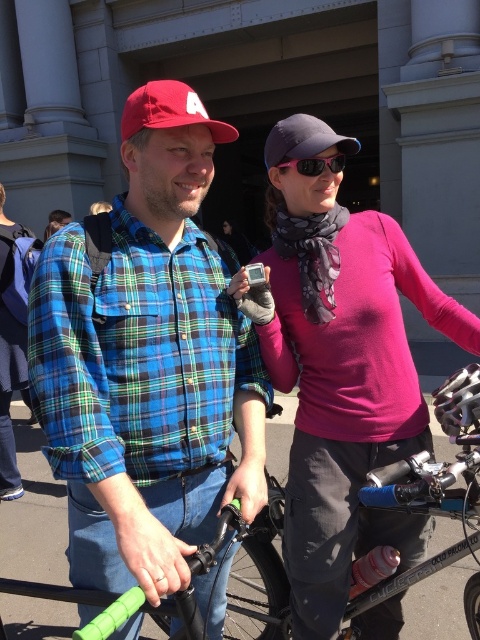
Question: Among these objects, which one is nearest to the camera?

Choices:
 (A) pink matte sweater at center
 (B) blue plaid shirt at center
 (C) dark gray fabric baseball cap at upper center

Answer: (B)

Question: Can you confirm if pink matte sweater at center is wider than dark gray fabric baseball cap at upper center?

Choices:
 (A) yes
 (B) no

Answer: (A)

Question: Is dark gray fabric baseball cap at upper center further to the viewer compared to pink matte sunglasses at upper center?

Choices:
 (A) no
 (B) yes

Answer: (B)

Question: Which point is farther to the camera?

Choices:
 (A) pink matte sunglasses at upper center
 (B) dark gray fabric baseball cap at upper center
 (C) blue plaid shirt at center
 (D) matte red baseball cap at upper left

Answer: (B)

Question: Among these objects, which one is nearest to the camera?

Choices:
 (A) pink matte sweater at center
 (B) matte red baseball cap at upper left
 (C) blue plaid shirt at center
 (D) pink matte sunglasses at upper center

Answer: (C)

Question: Can you confirm if dark gray fabric baseball cap at upper center is wider than pink matte sunglasses at upper center?

Choices:
 (A) yes
 (B) no

Answer: (A)